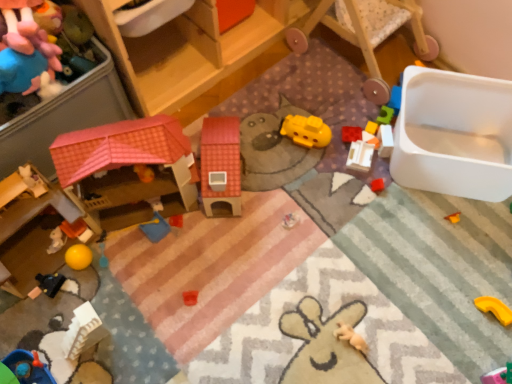
Image resolution: width=512 pixels, height=384 pixels. In order to click on free area in between yellow rubber toy at lower right, positioned as the 11th toy in left-to-right order, and yellow matte submarine at center, the 7th toy when ordered from right to left in this screenshot , I will do (389, 216).